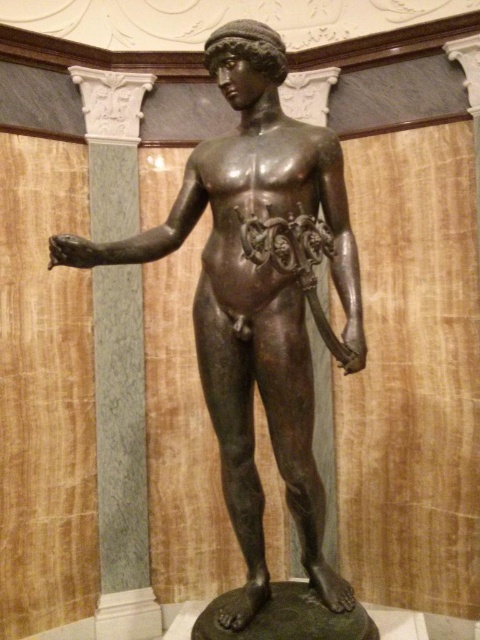
You are an art curator arranging a gallery layout. You need to place a new sculpture between the bronze statue at center and the white marble column at left. Where should you place it to ensure it is between them?

The bronze statue at center is positioned on the right side of the white marble column at left, so placing the new sculpture between them would require placing it to the right of the white marble column at left and to the left of the bronze statue at center.